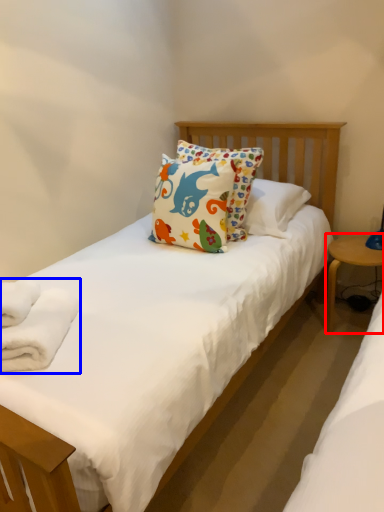
Question: Among these objects, which one is nearest to the camera, table (highlighted by a red box) or bath towel (highlighted by a blue box)?

Choices:
 (A) table
 (B) bath towel

Answer: (B)